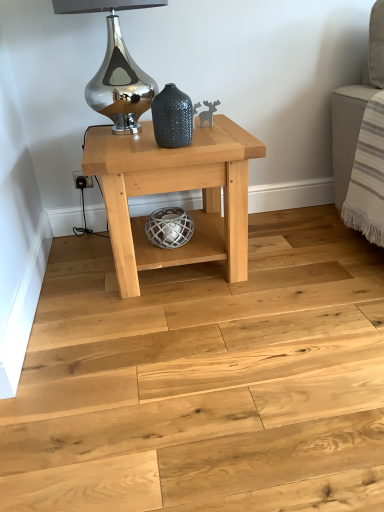
This screenshot has width=384, height=512. In order to click on free location to the right of textured dark gray vase at center in this screenshot , I will do `click(212, 141)`.